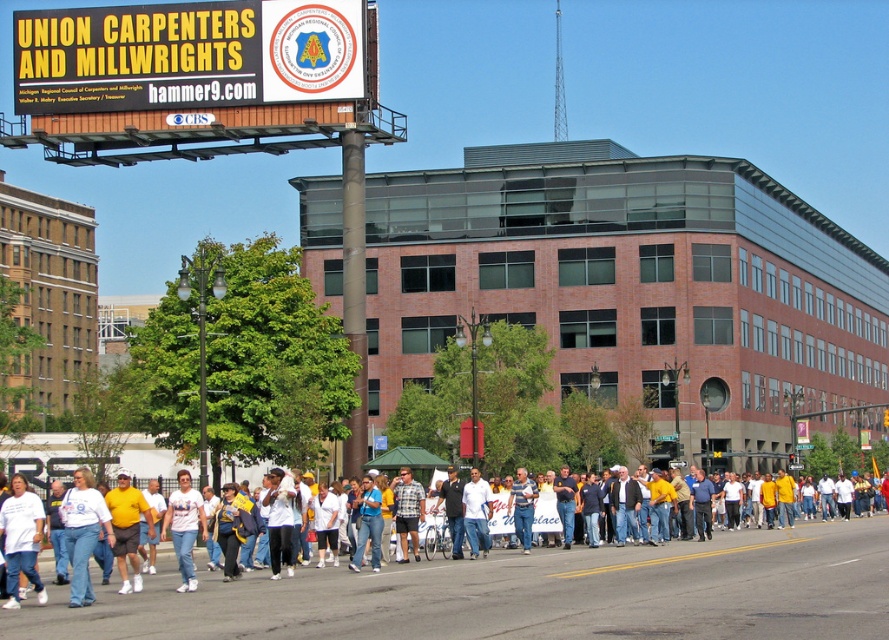
Between yellow t-shirt at center and white cotton shirt at center, which one is positioned lower?

white cotton shirt at center is below.

Is yellow t-shirt at center above white cotton shirt at center?

Indeed, yellow t-shirt at center is positioned over white cotton shirt at center.

Does point (140, 588) come farther from viewer compared to point (182, 560)?

Yes, point (140, 588) is farther from viewer.

This screenshot has height=640, width=889. I want to click on yellow t-shirt at center, so click(127, 529).

Does point (6, 515) come closer to viewer compared to point (125, 564)?

Yes, it is.

Can you confirm if white t-shirt at lower left is bigger than yellow t-shirt at center?

Actually, white t-shirt at lower left might be smaller than yellow t-shirt at center.

Locate an element on the screen. This screenshot has height=640, width=889. white t-shirt at lower left is located at coordinates (21, 538).

Image resolution: width=889 pixels, height=640 pixels. I want to click on white t-shirt at lower left, so click(21, 538).

Does white cotton t-shirts at center appear under blue jeans at center?

Indeed, white cotton t-shirts at center is positioned under blue jeans at center.

Is white cotton t-shirts at center to the left of blue jeans at center from the viewer's perspective?

Incorrect, white cotton t-shirts at center is not on the left side of blue jeans at center.

Between point (875, 612) and point (361, 509), which one is positioned behind?

Point (361, 509)

Locate an element on the screen. Image resolution: width=889 pixels, height=640 pixels. white cotton t-shirts at center is located at coordinates (517, 593).